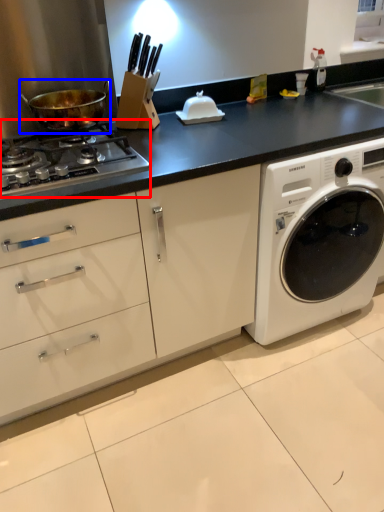
Question: Among these objects, which one is nearest to the camera, gas stove (highlighted by a red box) or wok (highlighted by a blue box)?

Choices:
 (A) gas stove
 (B) wok

Answer: (A)